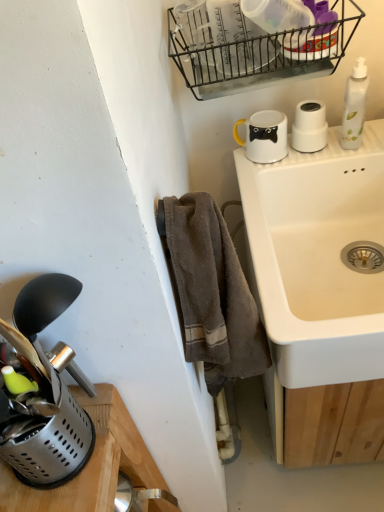
Where is `vacant point to the right of white matte cup at upper right, the third appliance ordered from the bottom`? This screenshot has height=512, width=384. vacant point to the right of white matte cup at upper right, the third appliance ordered from the bottom is located at coordinates pyautogui.click(x=362, y=139).